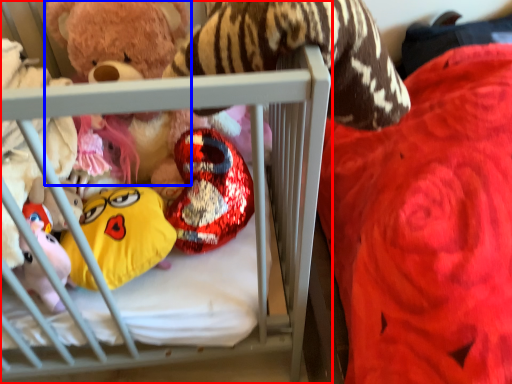
Question: Which point is closer to the camera, infant bed (highlighted by a red box) or toy (highlighted by a blue box)?

Choices:
 (A) infant bed
 (B) toy

Answer: (A)